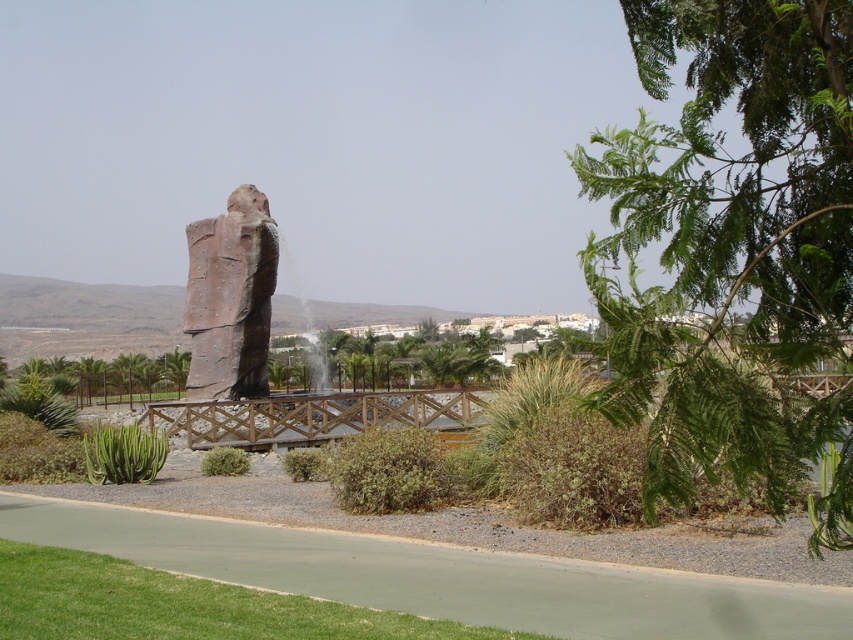
You are standing at the camera position and want to walk to both the point at coordinates (646, 156) and the point at coordinates (119, 388). Which point will you reach first?

You will reach point (646, 156) first because it is closer to the camera than point (119, 388).

You are standing at the entrance of the pathway and want to walk to the sculpture. Which point, point [773,388] or point [223,372], is closer to you as you start walking towards the sculpture?

Point [773,388] is closer to the viewer than point [223,372], so it is the closer one as you start walking towards the sculpture.